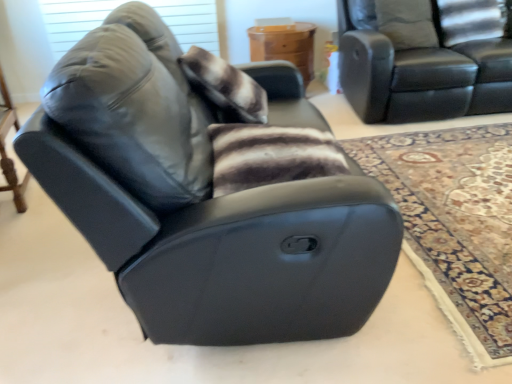
Question: Can you see wooden table at center, the first table from the back, touching black leather recliner at center?

Choices:
 (A) yes
 (B) no

Answer: (B)

Question: From the image's perspective, is wooden table at center, the 1th table from the right, on top of black leather recliner at center?

Choices:
 (A) yes
 (B) no

Answer: (A)

Question: Does wooden table at center, the second table positioned from the left, turn towards black leather recliner at center?

Choices:
 (A) yes
 (B) no

Answer: (A)

Question: Does wooden table at center, the second table viewed from the front, appear on the left side of black leather recliner at center?

Choices:
 (A) no
 (B) yes

Answer: (A)

Question: Is black leather recliner at center completely or partially inside wooden table at center, the first table from the back?

Choices:
 (A) yes
 (B) no

Answer: (B)

Question: Considering the positions of wooden table at left, the first table when ordered from left to right, and black leather recliner at center in the image, is wooden table at left, the first table when ordered from left to right, taller or shorter than black leather recliner at center?

Choices:
 (A) short
 (B) tall

Answer: (A)

Question: Is wooden table at left, which appears as the 2th table when viewed from the right, in front of or behind black leather recliner at center in the image?

Choices:
 (A) behind
 (B) front

Answer: (A)

Question: Is wooden table at left, the 1th table positioned from the bottom, inside or outside of black leather recliner at center?

Choices:
 (A) outside
 (B) inside

Answer: (A)

Question: From a real-world perspective, is wooden table at left, arranged as the first table when viewed from the front, physically located above or below black leather recliner at center?

Choices:
 (A) above
 (B) below

Answer: (B)

Question: Is fuzzy brown pillow at upper center to the left or to the right of black leather recliner at center in the image?

Choices:
 (A) left
 (B) right

Answer: (A)

Question: Looking at their shapes, would you say fuzzy brown pillow at upper center is wider or thinner than black leather recliner at center?

Choices:
 (A) wide
 (B) thin

Answer: (B)

Question: Is fuzzy brown pillow at upper center spatially inside black leather recliner at center, or outside of it?

Choices:
 (A) outside
 (B) inside

Answer: (B)

Question: From the image's perspective, is fuzzy brown pillow at upper center located above or below black leather recliner at center?

Choices:
 (A) below
 (B) above

Answer: (B)

Question: Considering the positions of matte gray window screen at upper left and black leather couch at upper right in the image, is matte gray window screen at upper left wider or thinner than black leather couch at upper right?

Choices:
 (A) thin
 (B) wide

Answer: (A)

Question: From the image's perspective, is matte gray window screen at upper left located above or below black leather couch at upper right?

Choices:
 (A) above
 (B) below

Answer: (A)